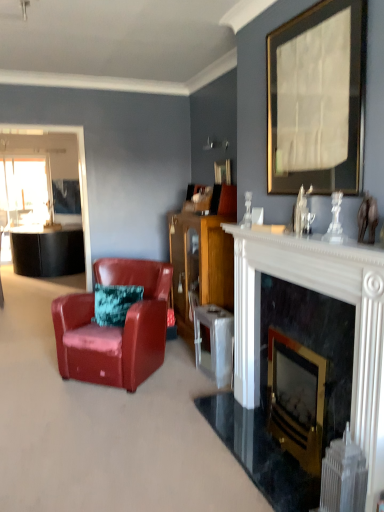
Identify the location of empty space that is ontop of black marble fireplace at center, arranged as the 2th fireplace when viewed from the left (from a real-world perspective). The height and width of the screenshot is (512, 384). (300, 284).